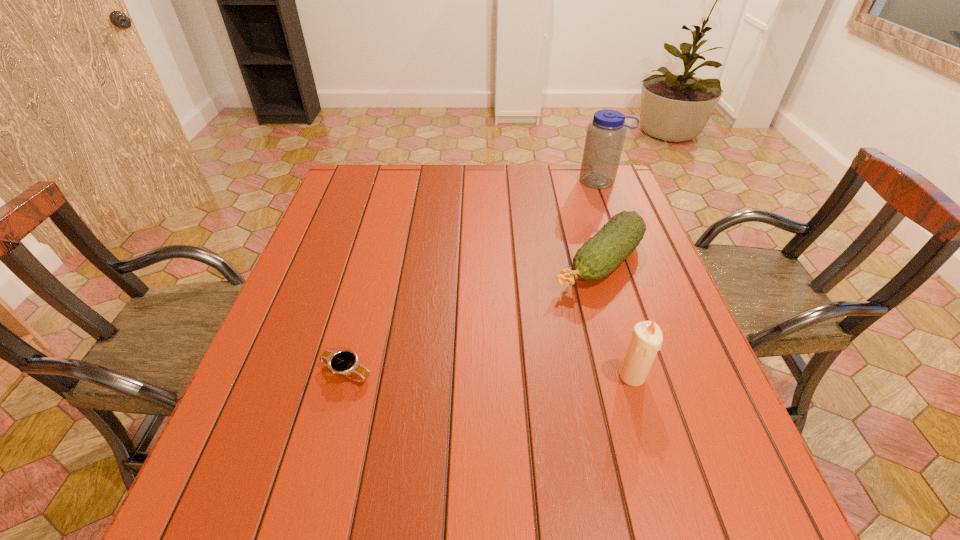
Locate an element on the screen. The height and width of the screenshot is (540, 960). blank area in the image that satisfies the following two spatial constraints: 1. on the back side of the cucumber; 2. on the right side of the second tallest object is located at coordinates (598, 261).

The width and height of the screenshot is (960, 540). I want to click on vacant space that satisfies the following two spatial constraints: 1. on the back side of the water bottle; 2. on the left side of the shortest object, so click(397, 181).

This screenshot has width=960, height=540. Find the location of `free space in the image that satisfies the following two spatial constraints: 1. on the back side of the leftmost object; 2. on the left side of the water bottle`. free space in the image that satisfies the following two spatial constraints: 1. on the back side of the leftmost object; 2. on the left side of the water bottle is located at coordinates (397, 181).